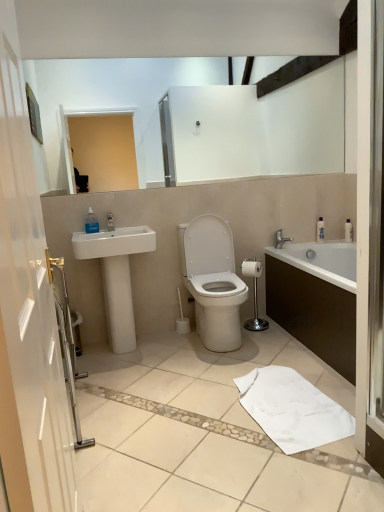
Question: Can we say white glossy sink at left lies outside white cotton bath towel at lower center?

Choices:
 (A) yes
 (B) no

Answer: (A)

Question: Is white glossy sink at left positioned with its back to white cotton bath towel at lower center?

Choices:
 (A) yes
 (B) no

Answer: (B)

Question: Does white glossy sink at left have a larger size compared to white cotton bath towel at lower center?

Choices:
 (A) no
 (B) yes

Answer: (B)

Question: Is white glossy sink at left not close to white cotton bath towel at lower center?

Choices:
 (A) yes
 (B) no

Answer: (A)

Question: Does white glossy sink at left lie in front of white cotton bath towel at lower center?

Choices:
 (A) yes
 (B) no

Answer: (B)

Question: Considering the positions of white matte toilet paper at center and white cotton bath towel at lower center in the image, is white matte toilet paper at center bigger or smaller than white cotton bath towel at lower center?

Choices:
 (A) big
 (B) small

Answer: (B)

Question: Considering the positions of white matte toilet paper at center and white cotton bath towel at lower center in the image, is white matte toilet paper at center wider or thinner than white cotton bath towel at lower center?

Choices:
 (A) wide
 (B) thin

Answer: (B)

Question: Does point (246, 260) appear closer or farther from the camera than point (302, 394)?

Choices:
 (A) farther
 (B) closer

Answer: (A)

Question: Is white matte toilet paper at center in front of or behind white cotton bath towel at lower center in the image?

Choices:
 (A) behind
 (B) front

Answer: (A)

Question: Looking at the image, does white glossy bathtub at right seem bigger or smaller compared to transparent glass screen door at right?

Choices:
 (A) big
 (B) small

Answer: (A)

Question: Relative to transparent glass screen door at right, is white glossy bathtub at right in front or behind?

Choices:
 (A) front
 (B) behind

Answer: (B)

Question: Is white glossy bathtub at right inside the boundaries of transparent glass screen door at right, or outside?

Choices:
 (A) inside
 (B) outside

Answer: (B)

Question: Based on their positions, is white glossy bathtub at right located to the left or right of transparent glass screen door at right?

Choices:
 (A) right
 (B) left

Answer: (A)

Question: Based on their sizes in the image, would you say clear plastic soap dispenser at upper left is bigger or smaller than white glossy bathtub at right?

Choices:
 (A) small
 (B) big

Answer: (A)

Question: Considering the positions of clear plastic soap dispenser at upper left and white glossy bathtub at right in the image, is clear plastic soap dispenser at upper left taller or shorter than white glossy bathtub at right?

Choices:
 (A) tall
 (B) short

Answer: (B)